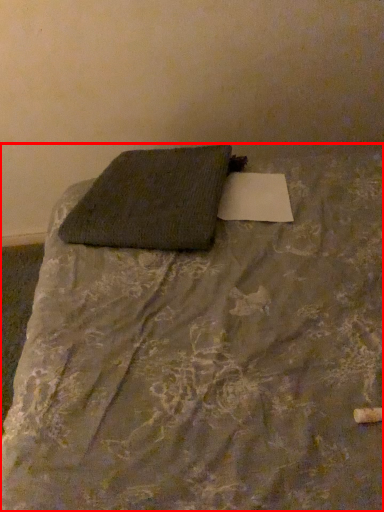
Question: From the image's perspective, where is bed (annotated by the red box) located in relation to pillow in the image?

Choices:
 (A) below
 (B) above

Answer: (A)